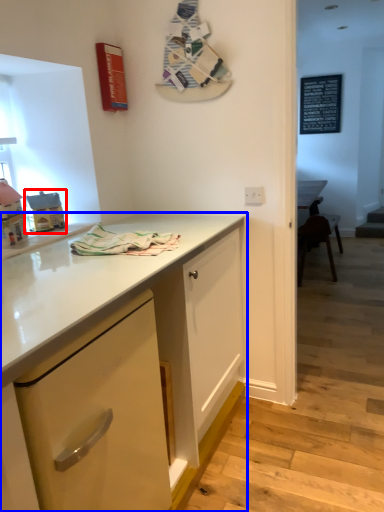
Question: Among these objects, which one is nearest to the camera, toy (highlighted by a red box) or cabinetry (highlighted by a blue box)?

Choices:
 (A) toy
 (B) cabinetry

Answer: (B)